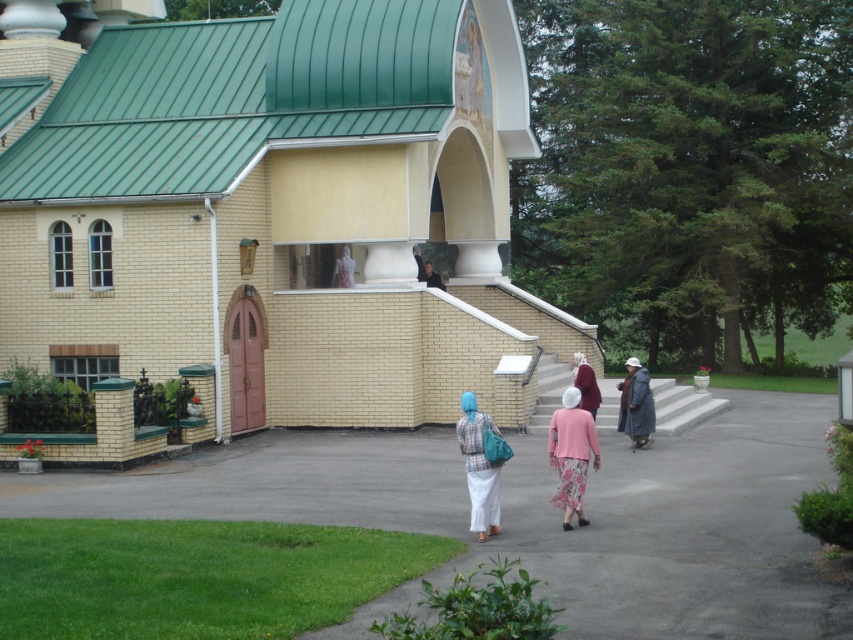
Which is below, plaid fabric dress at center or dark brown leather jacket at upper center?

plaid fabric dress at center is below.

Can you confirm if plaid fabric dress at center is taller than dark brown leather jacket at upper center?

Yes.

Which is behind, point (474, 426) or point (430, 278)?

The point (430, 278) is more distant.

Identify the location of plaid fabric dress at center. The image size is (853, 640). (479, 468).

Is pink floral dress at center below gray woolen coat at lower right?

Indeed, pink floral dress at center is positioned under gray woolen coat at lower right.

Who is higher up, pink floral dress at center or gray woolen coat at lower right?

gray woolen coat at lower right is above.

This screenshot has width=853, height=640. Find the location of `pink floral dress at center`. pink floral dress at center is located at coordinates (572, 454).

Does yellow brick church at center have a greater height compared to maroon fabric headscarf at center?

Yes, yellow brick church at center is taller than maroon fabric headscarf at center.

This screenshot has width=853, height=640. What do you see at coordinates (268, 220) in the screenshot?
I see `yellow brick church at center` at bounding box center [268, 220].

Does point (457, 152) come closer to viewer compared to point (576, 374)?

No, (457, 152) is further to viewer.

I want to click on yellow brick church at center, so click(268, 220).